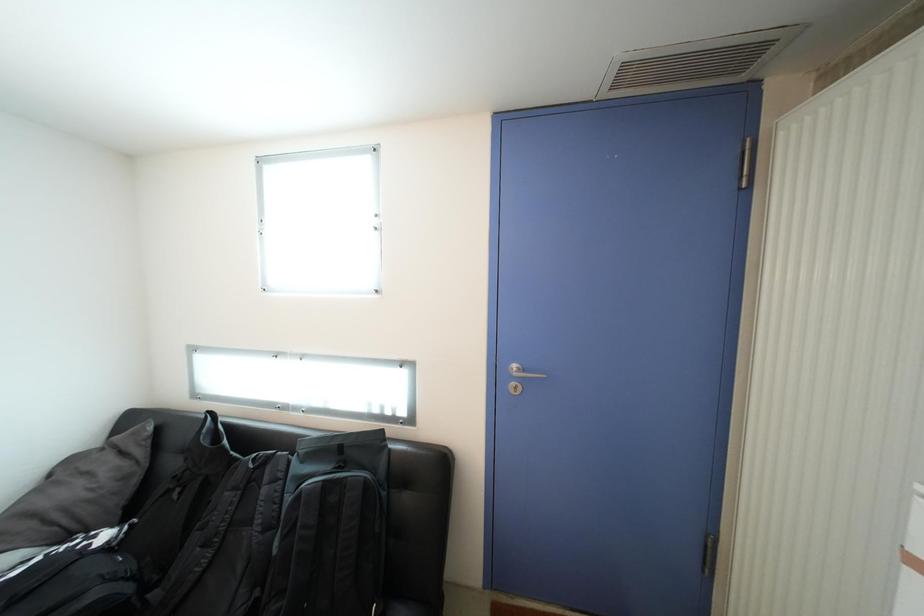
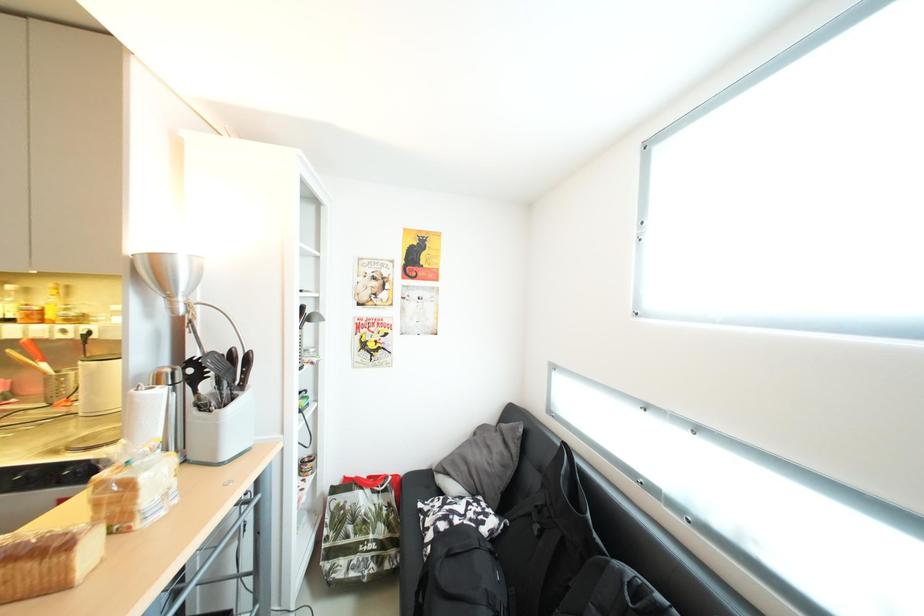
Question: The camera is either moving clockwise (left) or counter-clockwise (right) around the object. The first image is from the beginning of the video and the second image is from the end. Is the camera moving left or right when shooting the video?

Choices:
 (A) Left
 (B) Right

Answer: (B)